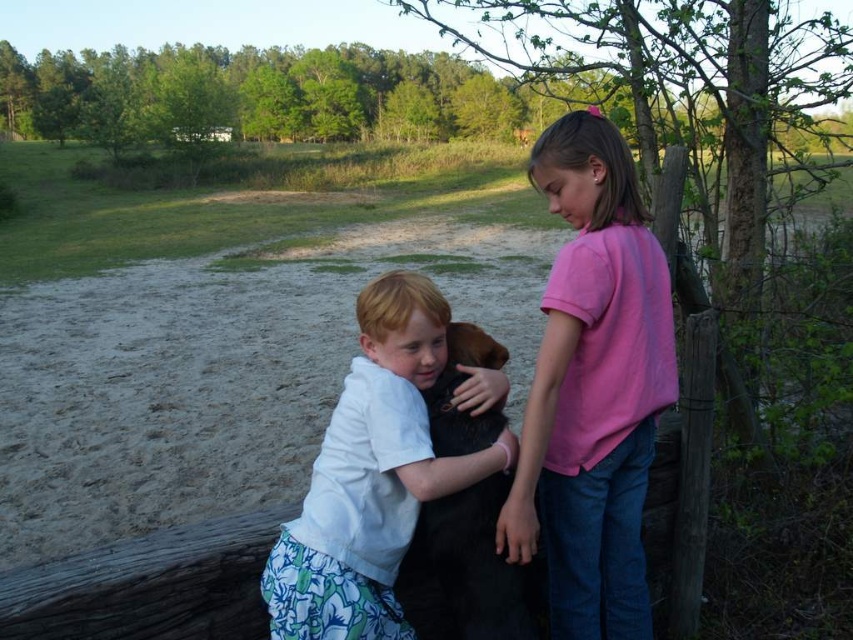
Question: Is smooth white shirt at center smaller than black fur dog at center?

Choices:
 (A) no
 (B) yes

Answer: (A)

Question: Based on their relative distances, which object is farther from the black fur dog at center?

Choices:
 (A) smooth white shirt at center
 (B) pink cotton shirt at upper right

Answer: (B)

Question: Does pink cotton shirt at upper right appear on the left side of black fur dog at center?

Choices:
 (A) no
 (B) yes

Answer: (A)

Question: Can you confirm if pink cotton shirt at upper right is smaller than smooth white shirt at center?

Choices:
 (A) yes
 (B) no

Answer: (B)

Question: Estimate the real-world distances between objects in this image. Which object is farther from the smooth white shirt at center?

Choices:
 (A) pink cotton shirt at upper right
 (B) black fur dog at center

Answer: (A)

Question: Which object appears closest to the camera in this image?

Choices:
 (A) black fur dog at center
 (B) smooth white shirt at center
 (C) pink cotton shirt at upper right

Answer: (B)